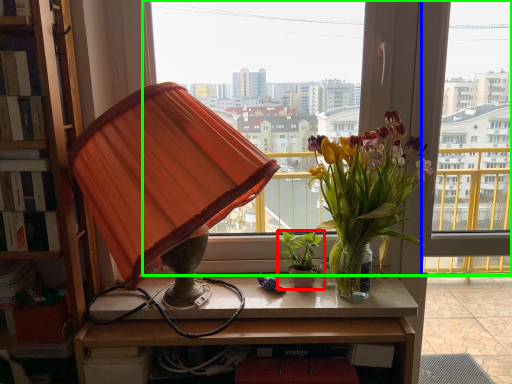
Question: Which is nearer to the houseplant (highlighted by a red box)? window (highlighted by a blue box) or window (highlighted by a green box).

Choices:
 (A) window
 (B) window

Answer: (A)